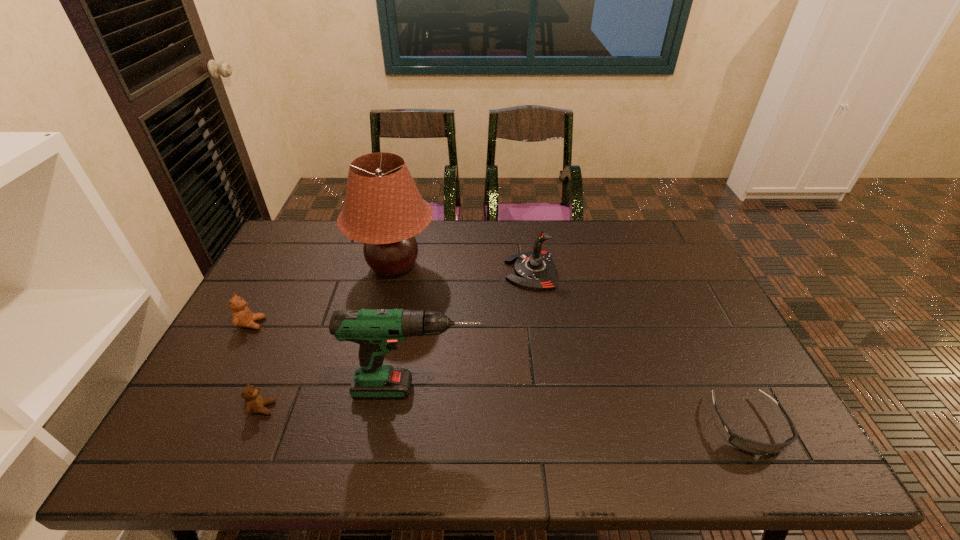
What are the coordinates of `vacant area that lies between the shortest object and the joystick` in the screenshot? It's located at (639, 348).

At what (x,y) coordinates should I click in order to perform the action: click on vacant area that lies between the fourth shortest object and the goggles. Please return your answer as a coordinate pair (x, y). Looking at the image, I should click on (639, 348).

What are the coordinates of `empty space between the tallest object and the fifth object from right to left` in the screenshot? It's located at (328, 337).

Where is `unoccupied area between the shortest object and the nearer teddy bear`? unoccupied area between the shortest object and the nearer teddy bear is located at coordinates (505, 416).

I want to click on vacant area that lies between the rightmost object and the drill, so click(x=582, y=407).

Identify which object is the nearest to the left teddy bear. Please provide its 2D coordinates. Your answer should be formatted as a tuple, i.e. [(x, y)], where the tuple contains the x and y coordinates of a point satisfying the conditions above.

[(383, 209)]

Identify which object is the third nearest to the joystick. Please provide its 2D coordinates. Your answer should be formatted as a tuple, i.e. [(x, y)], where the tuple contains the x and y coordinates of a point satisfying the conditions above.

[(749, 446)]